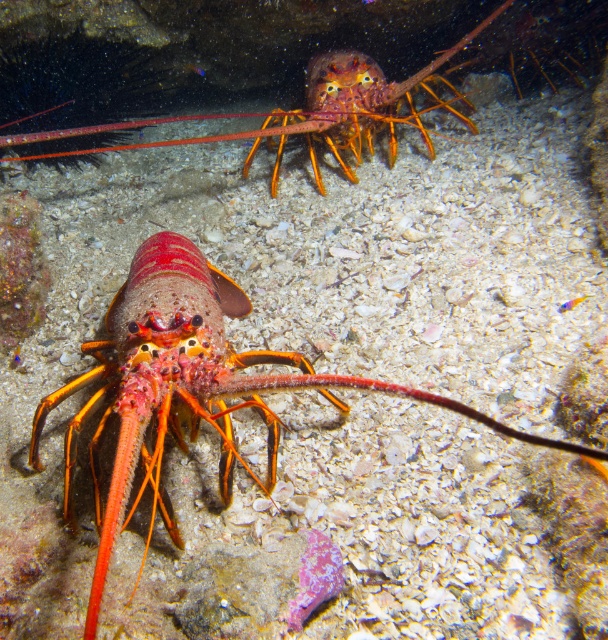
Question: Which object is closer to the camera taking this photo?

Choices:
 (A) shiny orange lobster at upper center
 (B) shiny orange lobster at center

Answer: (B)

Question: Is shiny orange lobster at center smaller than shiny orange lobster at upper center?

Choices:
 (A) no
 (B) yes

Answer: (B)

Question: Can you confirm if shiny orange lobster at center is positioned above shiny orange lobster at upper center?

Choices:
 (A) yes
 (B) no

Answer: (B)

Question: Does shiny orange lobster at center have a lesser width compared to shiny orange lobster at upper center?

Choices:
 (A) yes
 (B) no

Answer: (A)